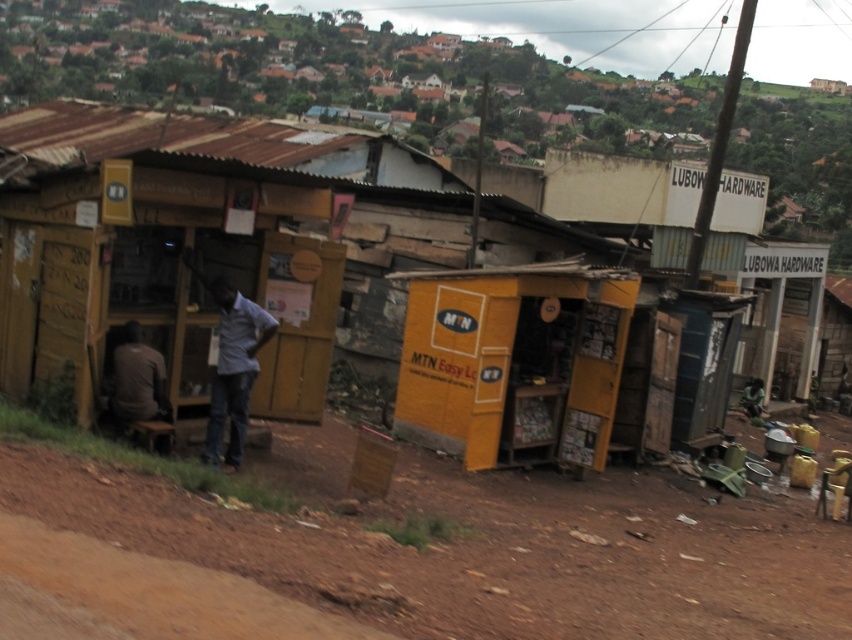
You are standing at the entrance of the rural market and want to locate two specific points marked in the image. The first point is at coordinate point (850, 564) and the second is at point (219, 396). Which of these points is closer to you?

Point (850, 564) is closer to the viewer than point (219, 396).

You are standing at the edge of the rural market scene. You see a brown dirt track at lower left and a light gray shirt at center. Which object is nearer to you?

The brown dirt track at lower left is closer to the viewer than the light gray shirt at center.